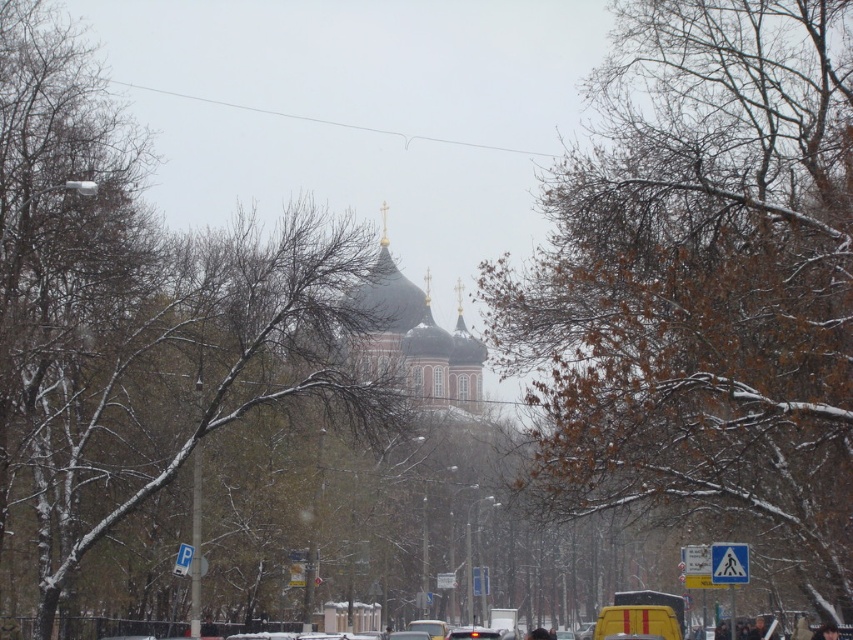
You are standing at the center of the street in the winter scene. You see a point marked at coordinates (701, 282). What object is located at that point?

The point at coordinates (701, 282) indicates a brown leafy tree at center.